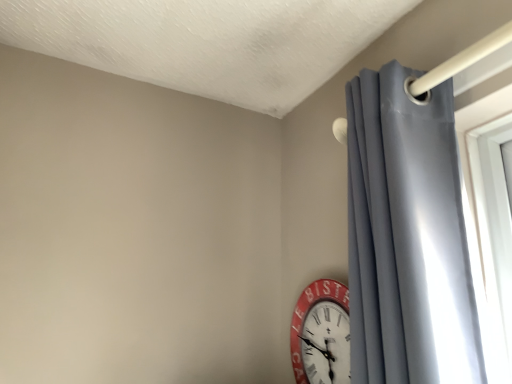
Question: Should I look upward or downward to see matte gray curtain at right?

Choices:
 (A) down
 (B) up

Answer: (A)